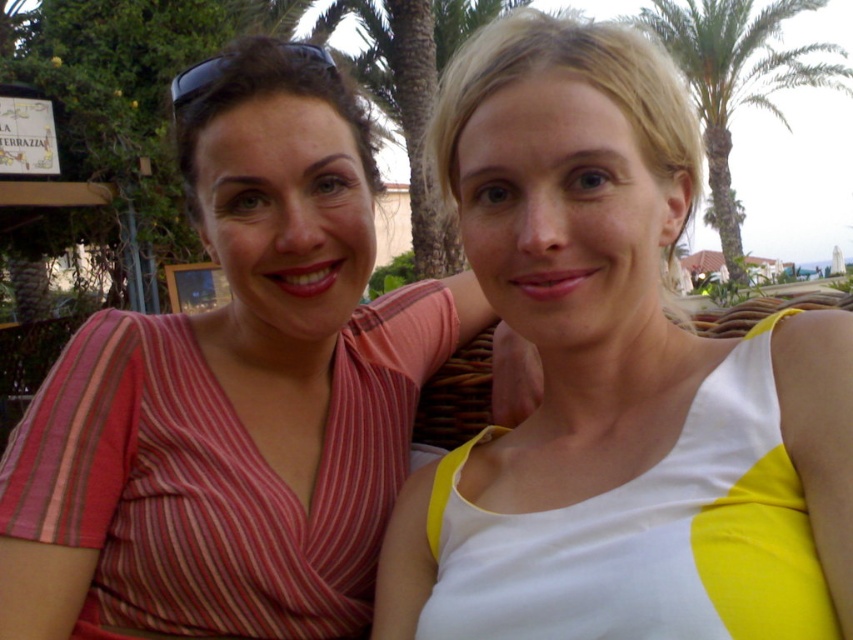
Is white/yellow fabric dress at center closer to camera compared to green leafy palm tree at upper right?

Yes, it is in front of green leafy palm tree at upper right.

Can you confirm if white/yellow fabric dress at center is taller than green leafy palm tree at upper right?

Yes, white/yellow fabric dress at center is taller than green leafy palm tree at upper right.

Where is `white/yellow fabric dress at center`? white/yellow fabric dress at center is located at coordinates (616, 381).

How distant is white/yellow fabric dress at center from striped fabric dress at left?

They are 13.76 inches apart.

Does white/yellow fabric dress at center appear under striped fabric dress at left?

Actually, white/yellow fabric dress at center is above striped fabric dress at left.

Is point (454, 145) closer to camera compared to point (339, 90)?

Yes, point (454, 145) is in front of point (339, 90).

Find the location of a particular element. The image size is (853, 640). white/yellow fabric dress at center is located at coordinates (616, 381).

Identify the location of striped fabric dress at left. This screenshot has width=853, height=640. (235, 394).

Does striped fabric dress at left appear over green leafy palm tree at upper right?

No.

Is point (251, 272) positioned in front of point (817, 77)?

Yes, it is in front of point (817, 77).

Where is `striped fabric dress at left`? The height and width of the screenshot is (640, 853). striped fabric dress at left is located at coordinates (235, 394).